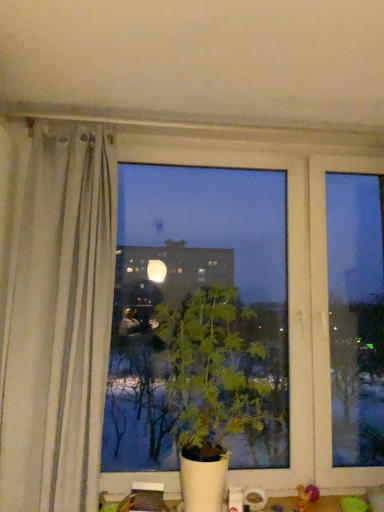
Question: Is green fabric toy at lower right smaller than green leafy plant at center?

Choices:
 (A) no
 (B) yes

Answer: (B)

Question: Is the depth of green fabric toy at lower right greater than that of green leafy plant at center?

Choices:
 (A) no
 (B) yes

Answer: (B)

Question: Does green fabric toy at lower right have a greater height compared to green leafy plant at center?

Choices:
 (A) no
 (B) yes

Answer: (A)

Question: From the image's perspective, is green fabric toy at lower right above green leafy plant at center?

Choices:
 (A) yes
 (B) no

Answer: (B)

Question: From a real-world perspective, does green fabric toy at lower right stand above green leafy plant at center?

Choices:
 (A) no
 (B) yes

Answer: (A)

Question: Can you confirm if green fabric toy at lower right is shorter than green leafy plant at center?

Choices:
 (A) yes
 (B) no

Answer: (A)

Question: Is green leafy plant at center facing away from green fabric toy at lower right?

Choices:
 (A) no
 (B) yes

Answer: (A)

Question: Does green leafy plant at center lie behind green fabric toy at lower right?

Choices:
 (A) yes
 (B) no

Answer: (B)

Question: Is green leafy plant at center beside green fabric toy at lower right?

Choices:
 (A) yes
 (B) no

Answer: (B)

Question: Considering the relative positions of green leafy plant at center and green fabric toy at lower right in the image provided, is green leafy plant at center to the left of green fabric toy at lower right from the viewer's perspective?

Choices:
 (A) yes
 (B) no

Answer: (A)

Question: Considering the relative positions of green leafy plant at center and green fabric toy at lower right in the image provided, is green leafy plant at center to the right of green fabric toy at lower right from the viewer's perspective?

Choices:
 (A) yes
 (B) no

Answer: (B)

Question: From the image's perspective, is green leafy plant at center over green fabric toy at lower right?

Choices:
 (A) yes
 (B) no

Answer: (A)

Question: Considering the relative positions of green fabric toy at lower right and green leafy plant at center in the image provided, is green fabric toy at lower right to the left or to the right of green leafy plant at center?

Choices:
 (A) right
 (B) left

Answer: (A)